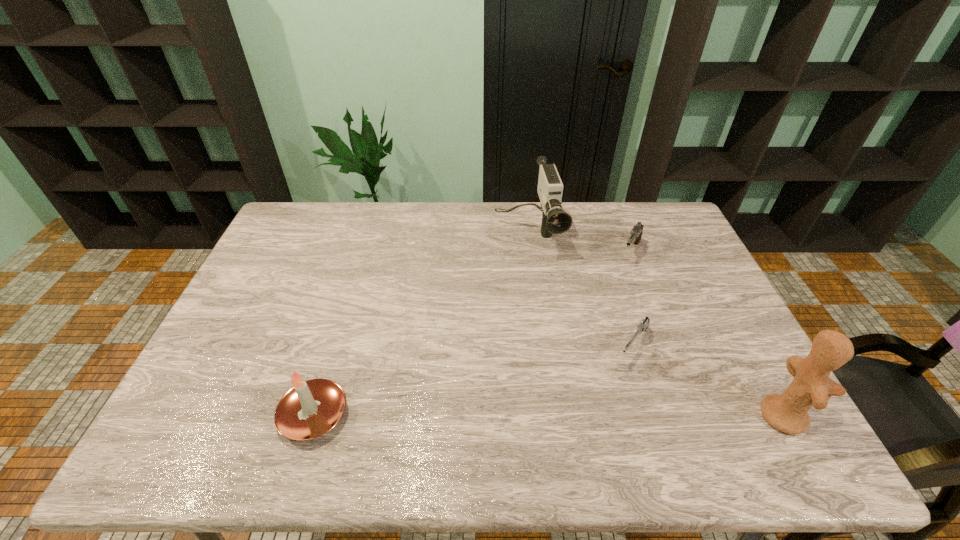
The image size is (960, 540). Identify the location of free space between the taller pistol and the leftmost object. (472, 334).

This screenshot has height=540, width=960. I want to click on free space between the second tallest object and the nearer pistol, so click(x=581, y=290).

Select which object appears as the closest to the fourth shortest object. Please provide its 2D coordinates. Your answer should be formatted as a tuple, i.e. [(x, y)], where the tuple contains the x and y coordinates of a point satisfying the conditions above.

[(636, 233)]

Select which object appears as the closest to the rightmost object. Please provide its 2D coordinates. Your answer should be formatted as a tuple, i.e. [(x, y)], where the tuple contains the x and y coordinates of a point satisfying the conditions above.

[(643, 325)]

Where is `free spot that satisfies the following two spatial constraints: 1. on the front side of the camcorder; 2. on the front-facing side of the tallest object`? Image resolution: width=960 pixels, height=540 pixels. free spot that satisfies the following two spatial constraints: 1. on the front side of the camcorder; 2. on the front-facing side of the tallest object is located at coordinates (551, 415).

This screenshot has width=960, height=540. Find the location of `vacant space that satisfies the following two spatial constraints: 1. on the front side of the tallest object; 2. on the front-facing side of the taller pistol`. vacant space that satisfies the following two spatial constraints: 1. on the front side of the tallest object; 2. on the front-facing side of the taller pistol is located at coordinates (693, 415).